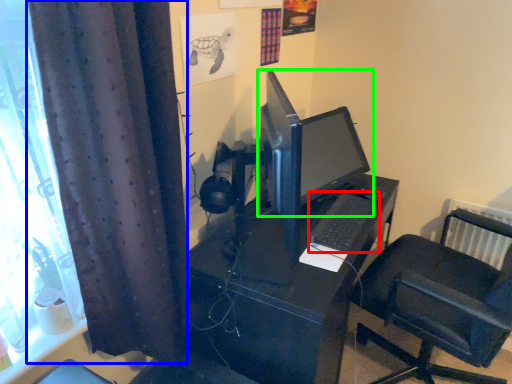
Question: Considering the real-world distances, which object is farthest from computer keyboard (highlighted by a red box)? curtain (highlighted by a blue box) or computer monitor (highlighted by a green box)?

Choices:
 (A) curtain
 (B) computer monitor

Answer: (A)